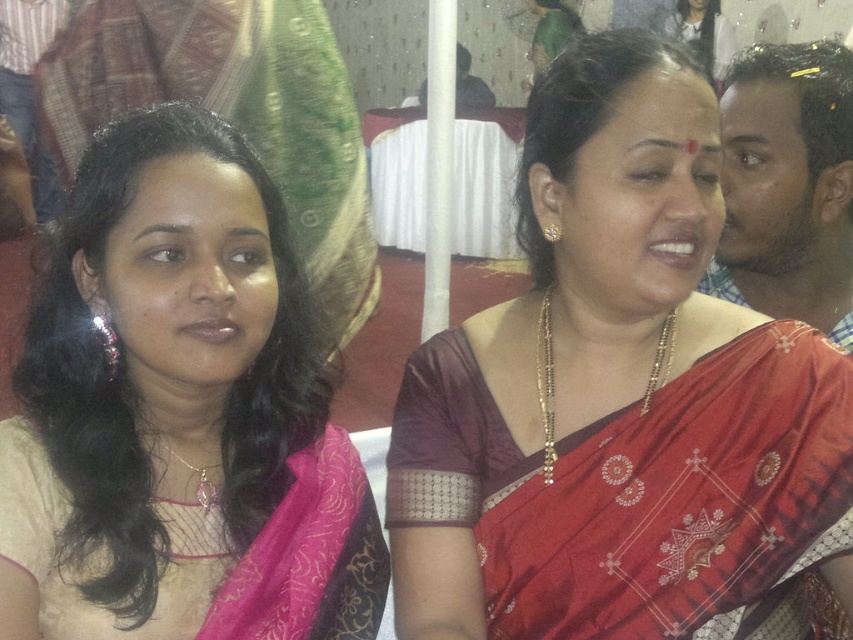
The height and width of the screenshot is (640, 853). Describe the element at coordinates (616, 396) in the screenshot. I see `matte gold necklace at upper center` at that location.

Which of these two, matte gold necklace at upper center or pink silk saree at left, stands taller?

Standing taller between the two is matte gold necklace at upper center.

Does point (712, 312) lie behind point (352, 544)?

Yes, it is.

Image resolution: width=853 pixels, height=640 pixels. Find the location of `matte gold necklace at upper center`. matte gold necklace at upper center is located at coordinates (616, 396).